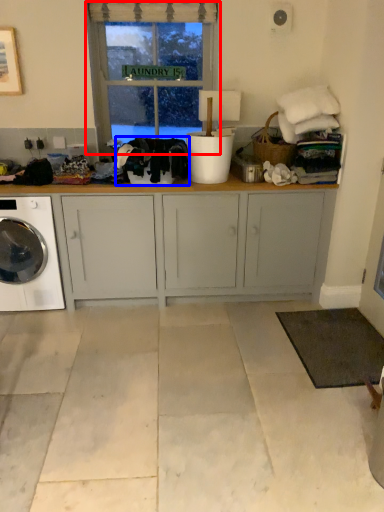
Question: Which object appears farthest to the camera in this image, window (highlighted by a red box) or clothing (highlighted by a blue box)?

Choices:
 (A) window
 (B) clothing

Answer: (A)